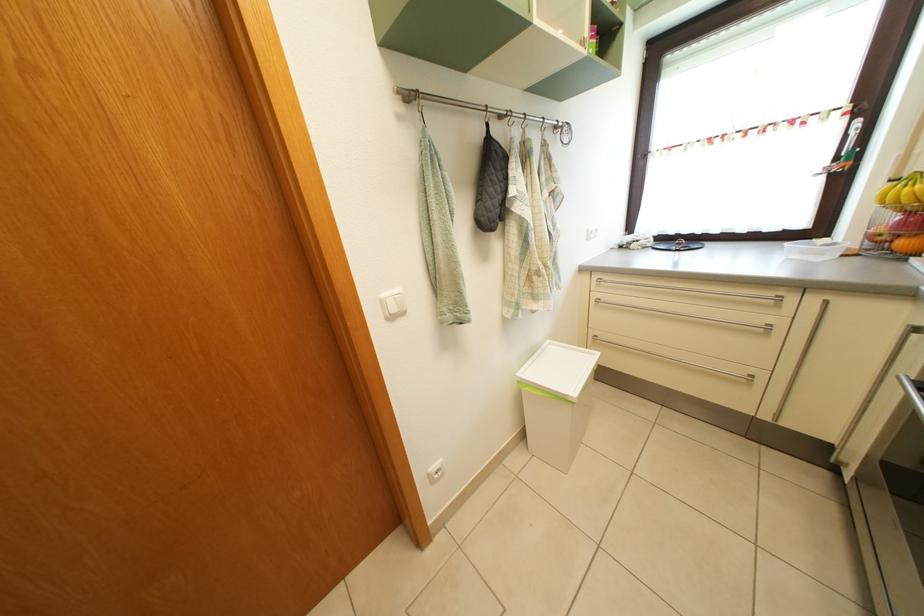
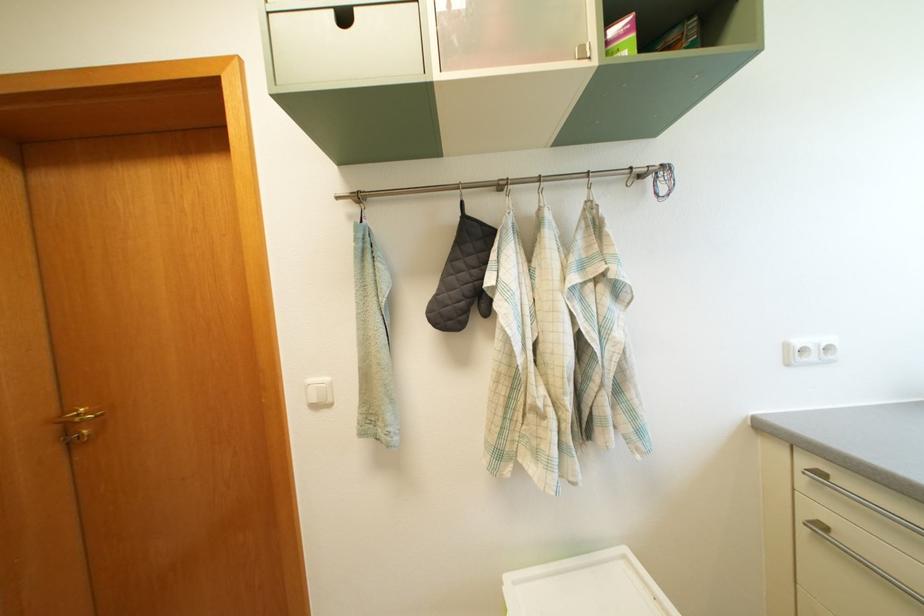
Question: The camera is either moving clockwise (left) or counter-clockwise (right) around the object. The first image is from the beginning of the video and the second image is from the end. Is the camera moving left or right when shooting the video?

Choices:
 (A) Left
 (B) Right

Answer: (B)